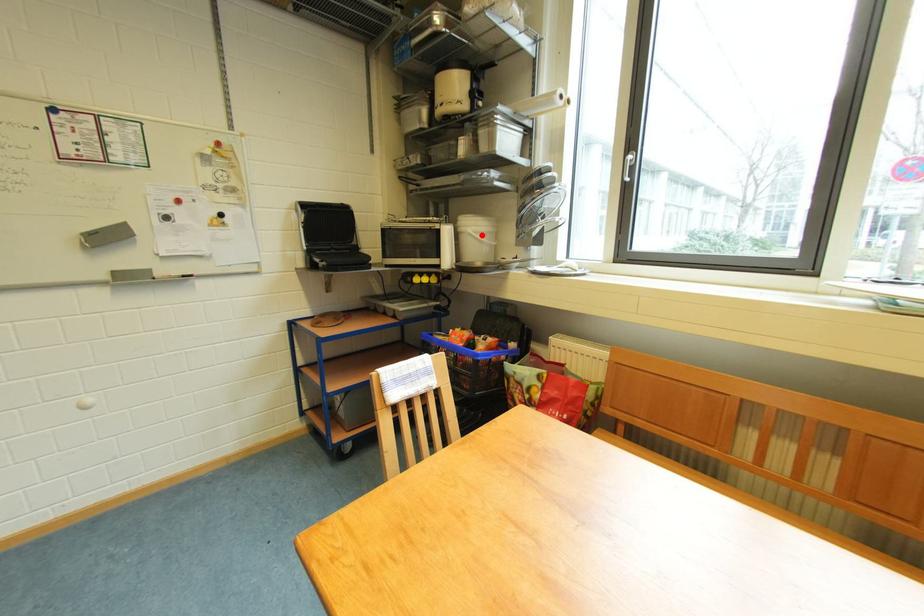
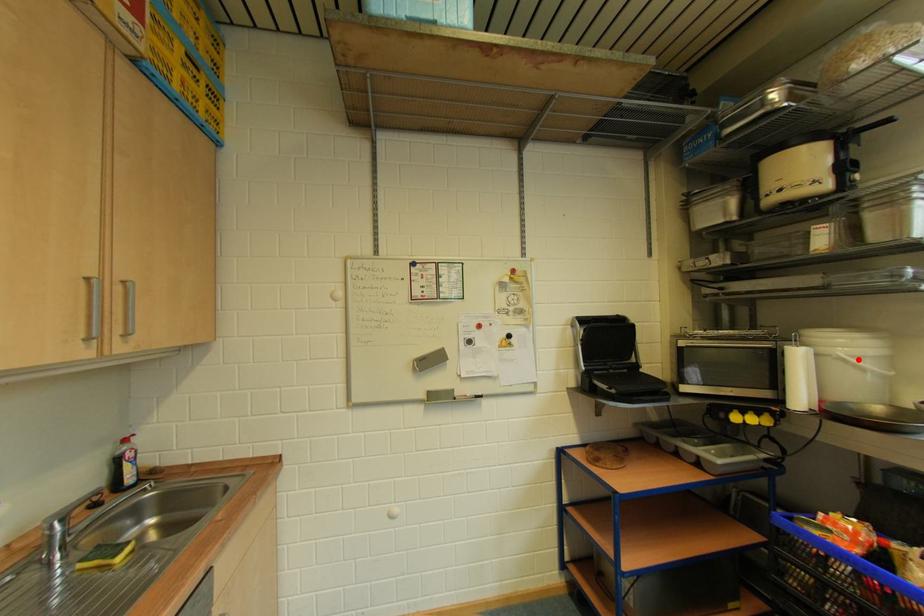
I am providing you with two images of the same scene from different viewpoints. A red point is marked on the first image and another point is marked on the second image. Is the red point in image1 aligned with the point shown in image2?

Yes